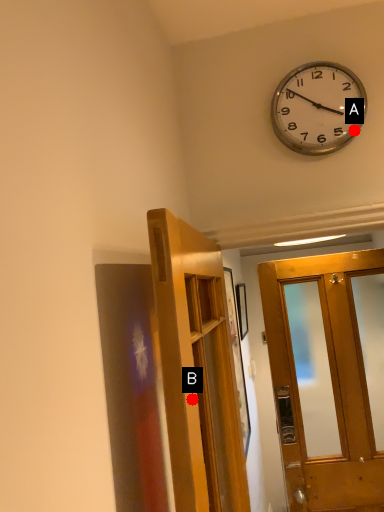
Question: Two points are circled on the image, labeled by A and B beside each circle. Which point is farther from the camera taking this photo?

Choices:
 (A) A is further
 (B) B is further

Answer: (A)